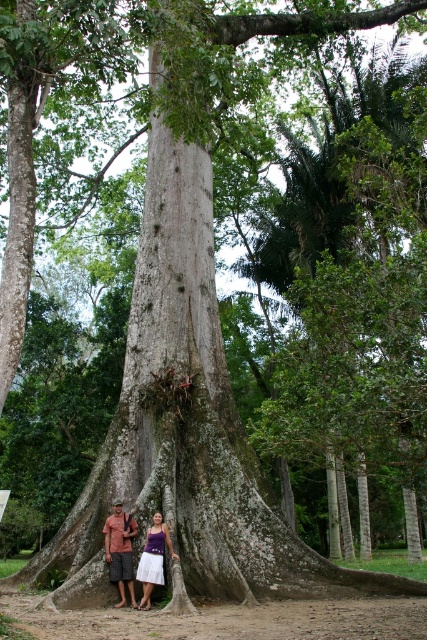
You are planning to take a group photo with two people wearing the white cotton dress at center and brown cotton shirt at lower center. If you want to ensure both are fully visible in the frame, which clothing item should be positioned closer to the camera to avoid being obscured?

The white cotton dress at center might be wider than brown cotton shirt at lower center, so positioning the person in the white cotton dress at center closer to the camera would help ensure both are fully visible without one blocking the other.

You are a photographer trying to capture a photo of the two people in front of the tree. Since the brown cotton shirt at lower center and white cotton dress at lower center are close together, can you tell me which clothing item is narrower?

The brown cotton shirt at lower center is narrower than the white cotton dress at lower center.

You are a photographer planning to take a picture of the two people in front of the majestic tree. The white cotton dress at center and the brown cotton shirt at lower center are part of their outfits. Based on their clothing lengths, which outfit would be more likely to cover the knees of the person wearing it?

The brown cotton shirt at lower center is longer than the white cotton dress at center, so the brown cotton shirt at lower center would more likely cover the knees of the person wearing it.